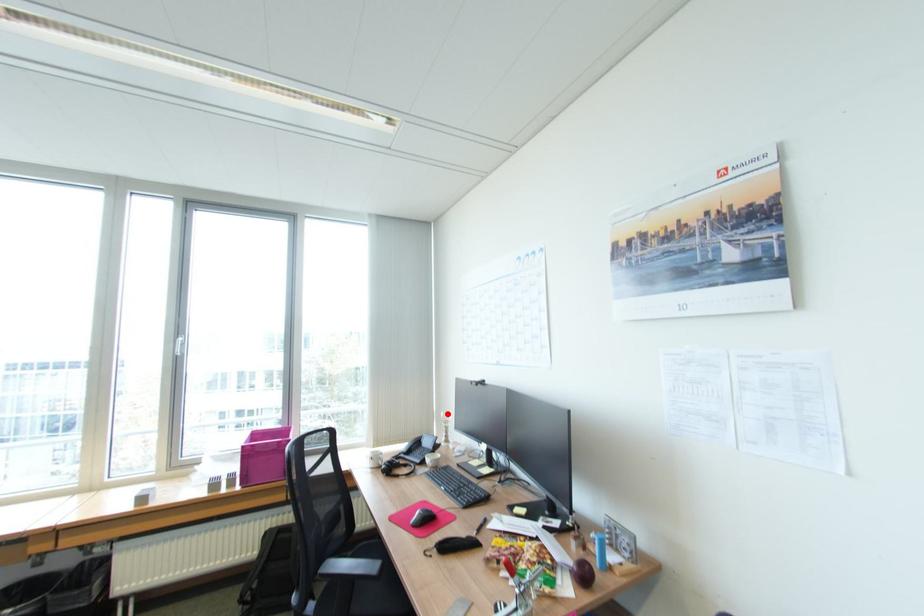
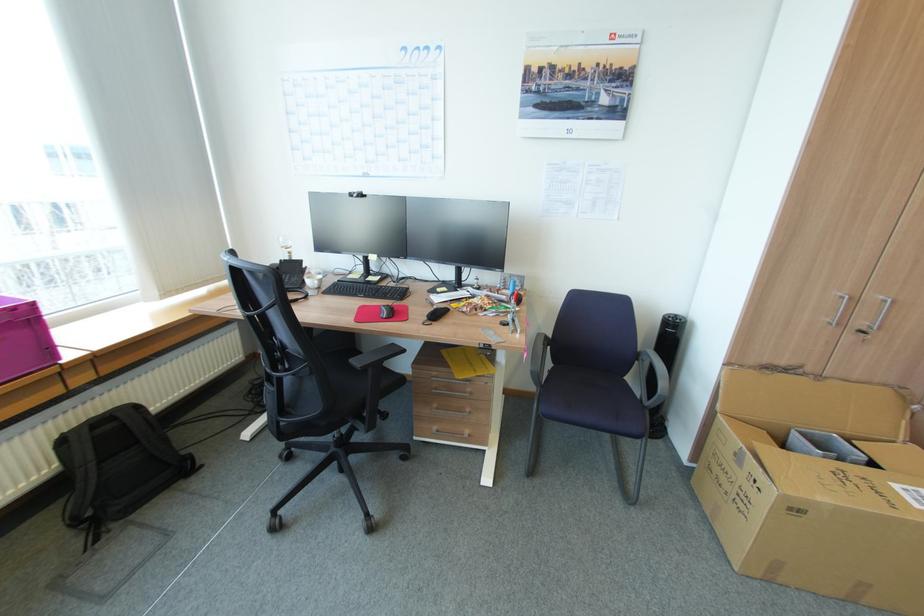
In the second image, find the point that corresponds to the highlighted location in the first image.

(286, 238)